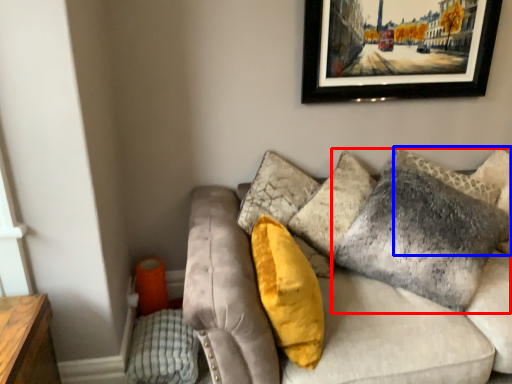
Question: Which object is further to the camera taking this photo, pillow (highlighted by a red box) or pillow (highlighted by a blue box)?

Choices:
 (A) pillow
 (B) pillow

Answer: (B)